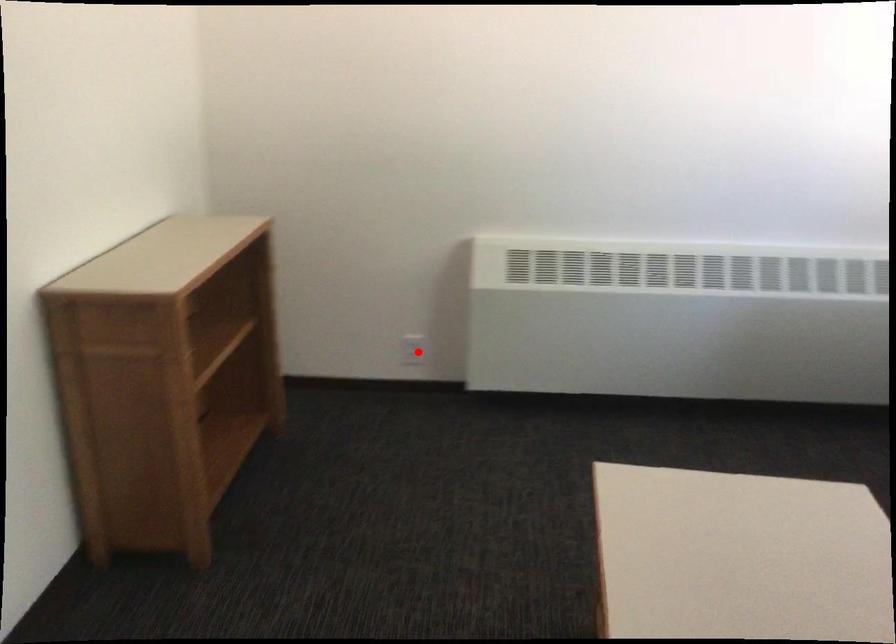
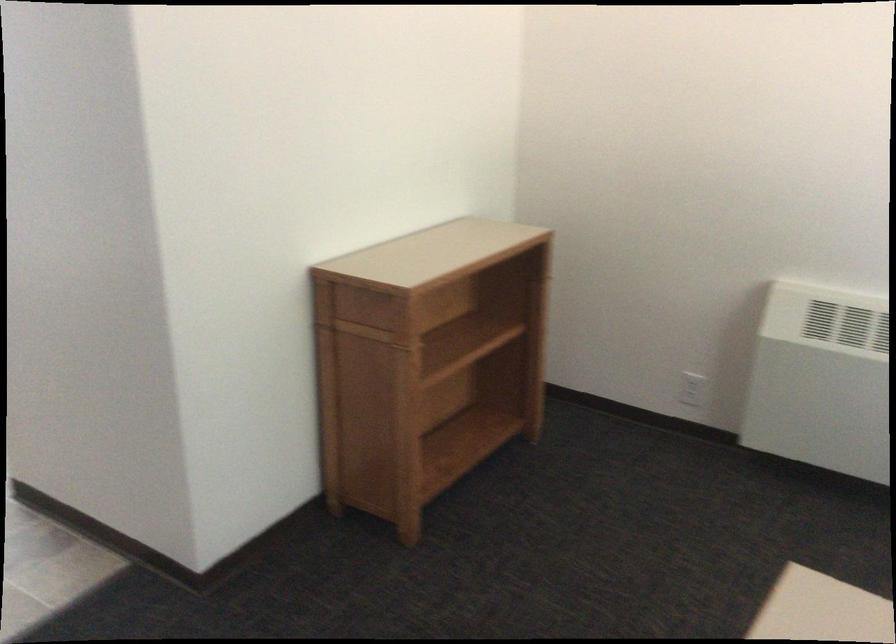
Question: I am providing you with two images of the same scene from different viewpoints. A red point is marked on the first image. At the location where the point appears in image 1, is it still visible in image 2?

Choices:
 (A) Yes
 (B) No

Answer: (A)